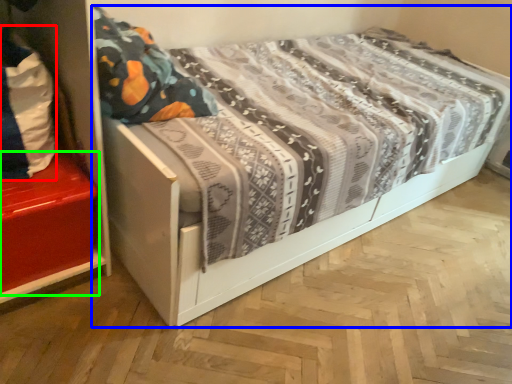
Question: Considering the real-world distances, which object is farthest from material (highlighted by a red box)? bed (highlighted by a blue box) or shelf (highlighted by a green box)?

Choices:
 (A) bed
 (B) shelf

Answer: (A)